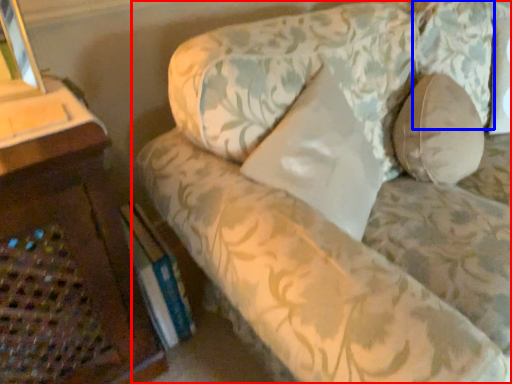
Question: Which of the following is the closest to the observer, studio couch (highlighted by a red box) or pillow (highlighted by a blue box)?

Choices:
 (A) studio couch
 (B) pillow

Answer: (A)